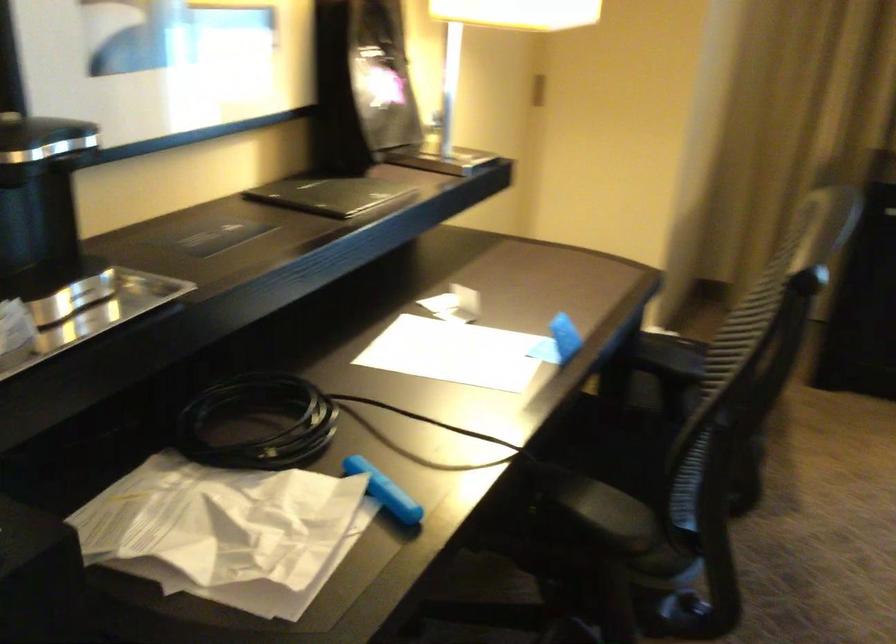
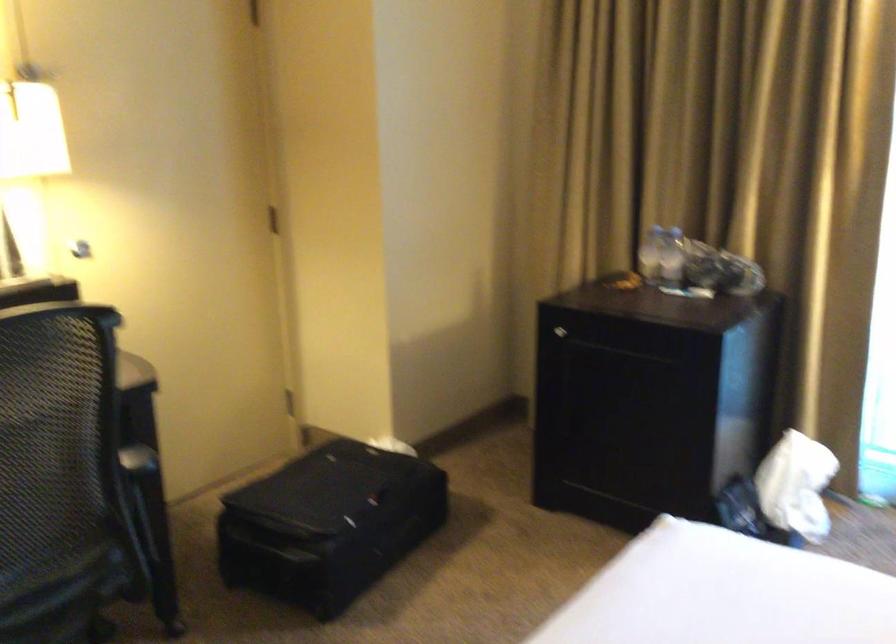
Locate, in the second image, the point that corresponds to [658,435] in the first image.

(136, 527)